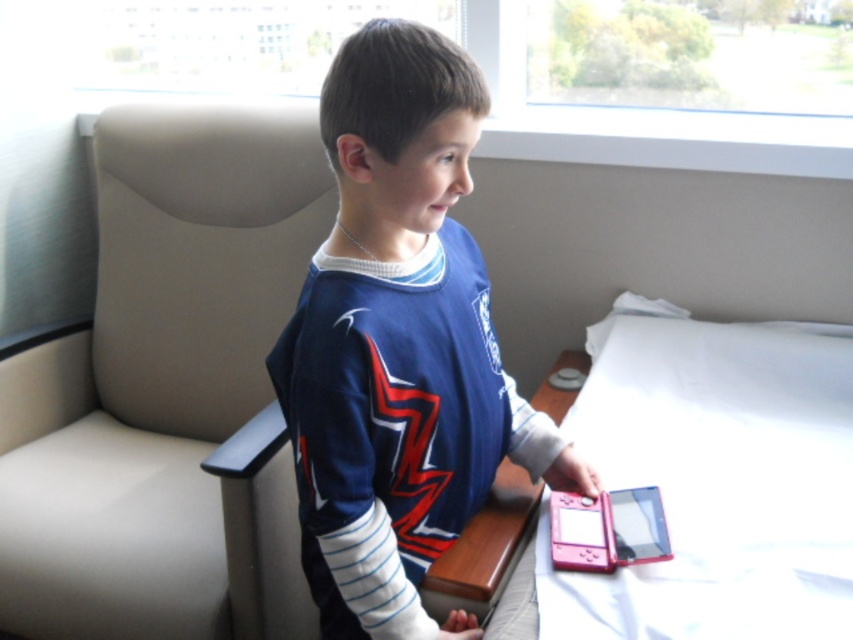
You are helping organize a child safety workshop. You have the blue jersey at center and the pink plastic game console at lower right. Which item should you place in a storage box that can only hold items smaller than the other? Please explain your choice based on their sizes.

The pink plastic game console at lower right should be placed in the storage box because it is smaller than the blue jersey at center, which is bigger and cannot fit into the box.

You are a delivery person who needs to place a small package between the pink plastic game console at lower right and the pink plastic tablet at lower right. Can you fit it there?

The distance between the pink plastic game console at lower right and the pink plastic tablet at lower right is 1.49 inches. If the package is smaller than 1.49 inches in length, it can fit between them. However, if it is larger, it won t fit.

Looking at this image, you are an interior designer asked to place a new lamp in the room. The lamp must be positioned exactly at the coordinates where the blue jersey at center is currently located. Can you confirm the exact coordinates where you should place the lamp?

The blue jersey at center is located at coordinates point (x=399, y=346), so you should place the lamp at those exact coordinates.